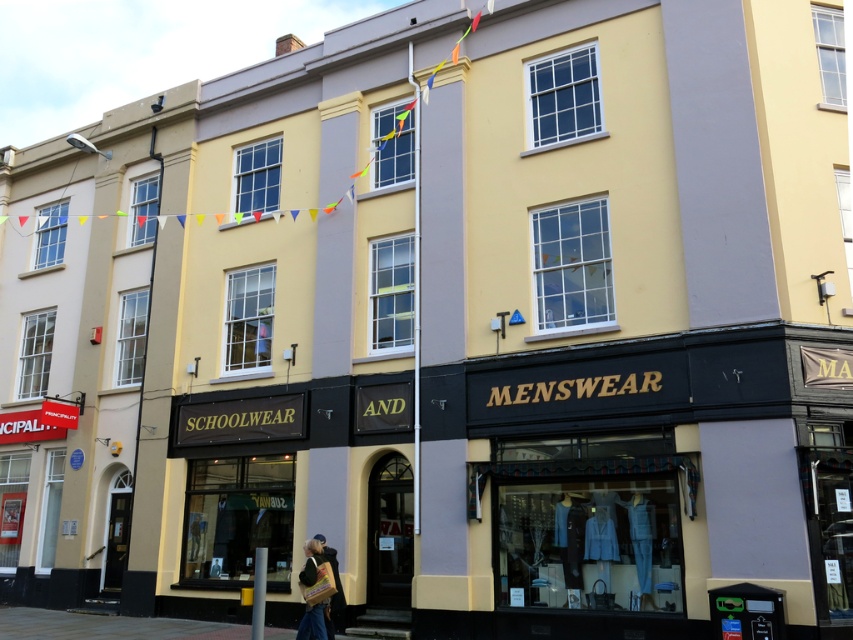
Question: Does leather jacket at lower center appear over denim jacket at lower center?

Choices:
 (A) no
 (B) yes

Answer: (A)

Question: Does leather jacket at lower center have a larger size compared to denim jacket at lower center?

Choices:
 (A) no
 (B) yes

Answer: (A)

Question: Does leather jacket at lower center appear on the right side of denim jacket at lower center?

Choices:
 (A) yes
 (B) no

Answer: (B)

Question: Which object is farther from the camera taking this photo?

Choices:
 (A) denim jacket at lower center
 (B) leather jacket at lower center

Answer: (A)